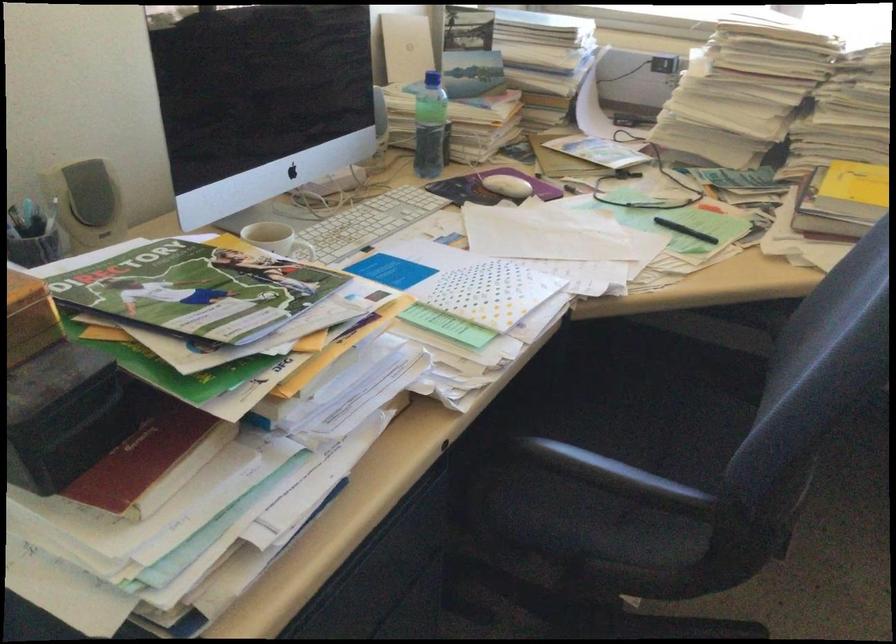
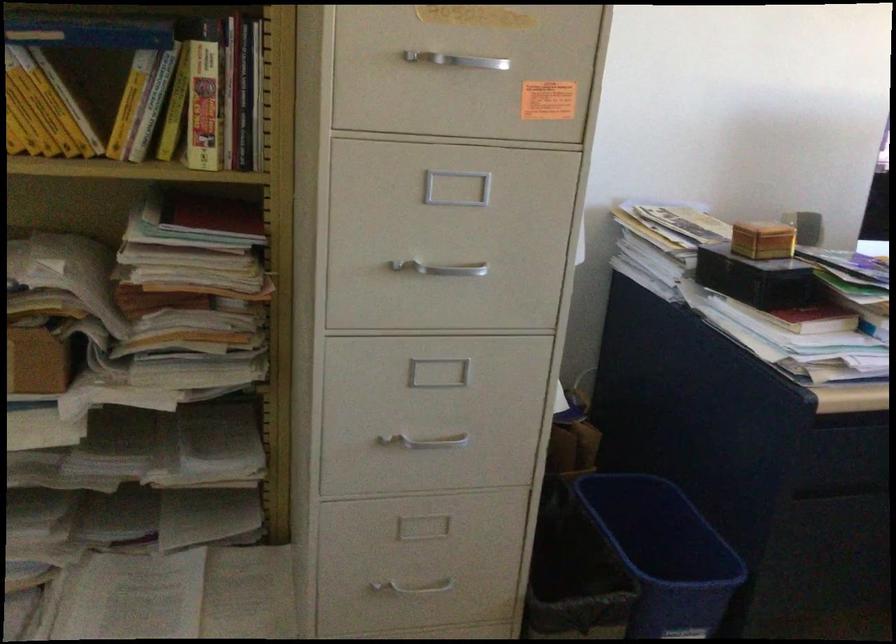
Question: The camera is either moving clockwise (left) or counter-clockwise (right) around the object. The first image is from the beginning of the video and the second image is from the end. Is the camera moving left or right when shooting the video?

Choices:
 (A) Left
 (B) Right

Answer: (B)